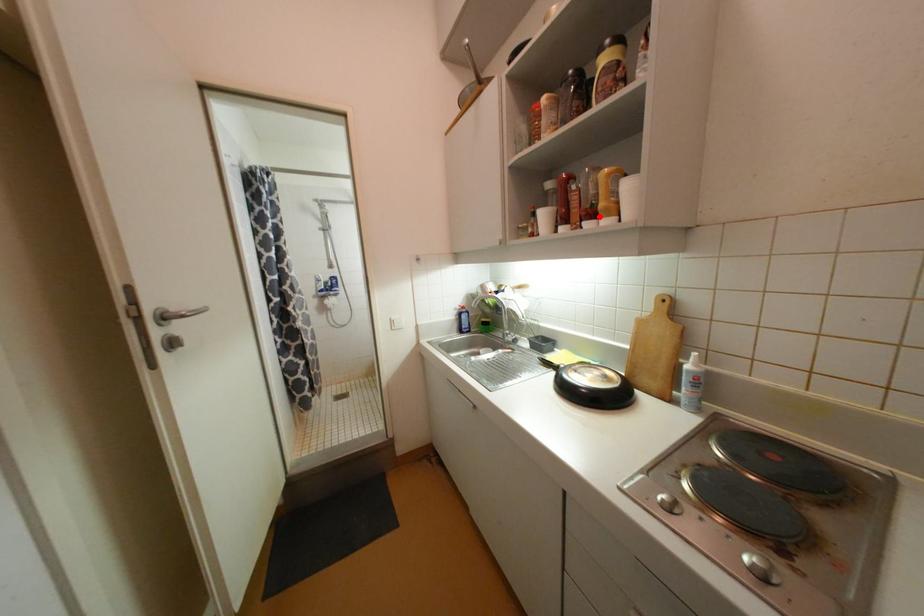
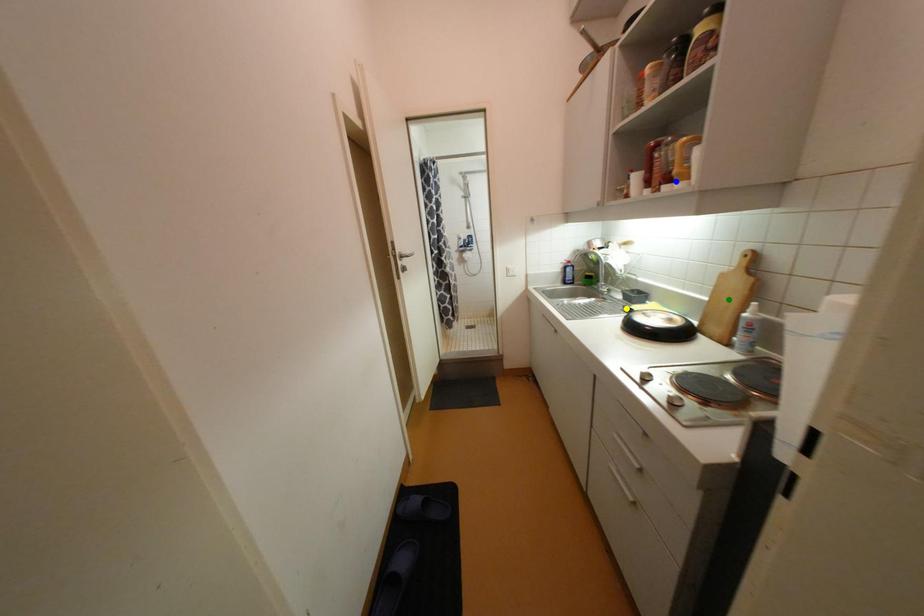
Question: I am providing you with two images of the same scene from different viewpoints. A red point is marked on the first image. You are given multiple points on the second image. Can you choose the point in image 2 that corresponds to the point in image 1?

Choices:
 (A) yellow point
 (B) green point
 (C) blue point

Answer: (C)